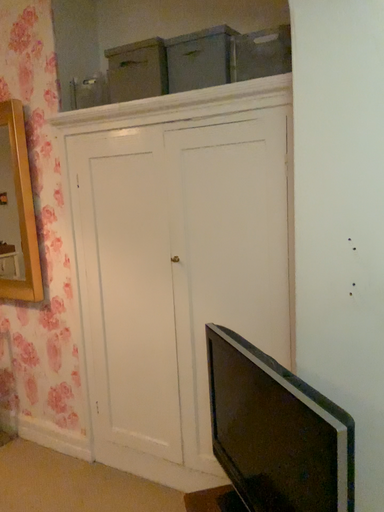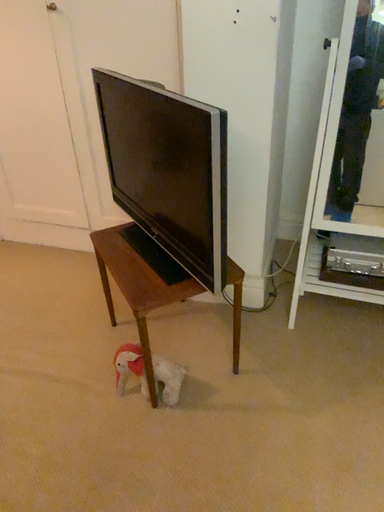
Question: Which way did the camera rotate in the video?

Choices:
 (A) rotated upward
 (B) rotated downward

Answer: (B)